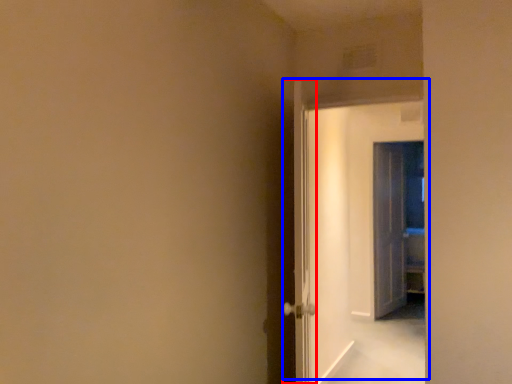
Question: Which object is further to the camera taking this photo, door (highlighted by a red box) or door (highlighted by a blue box)?

Choices:
 (A) door
 (B) door

Answer: (B)